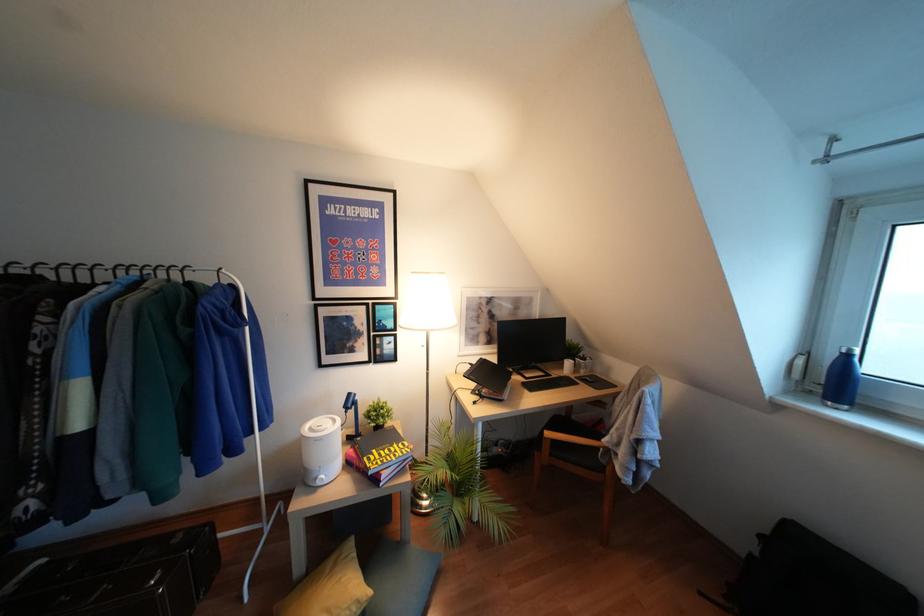
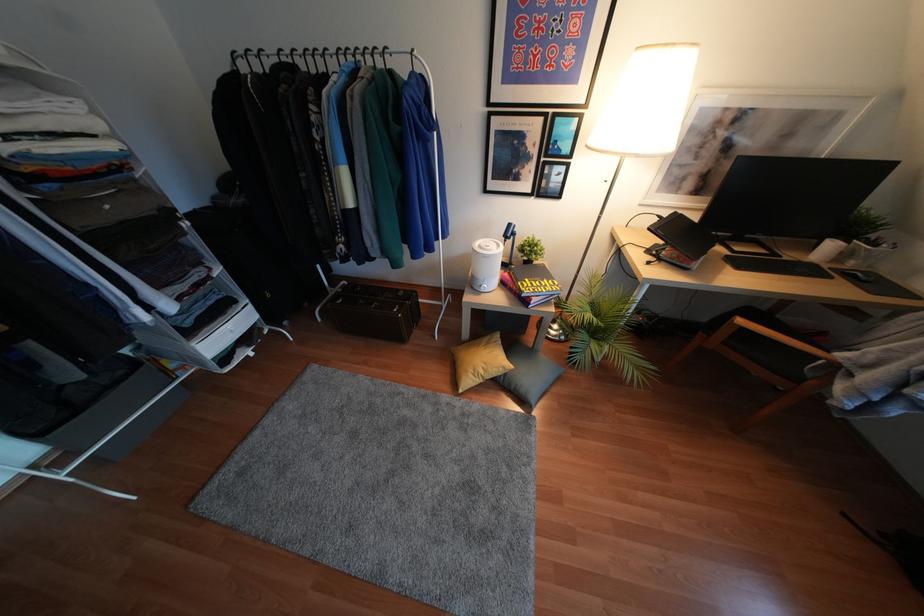
Find the pixel in the second image that matches pixel 370 472 in the first image.

(523, 294)